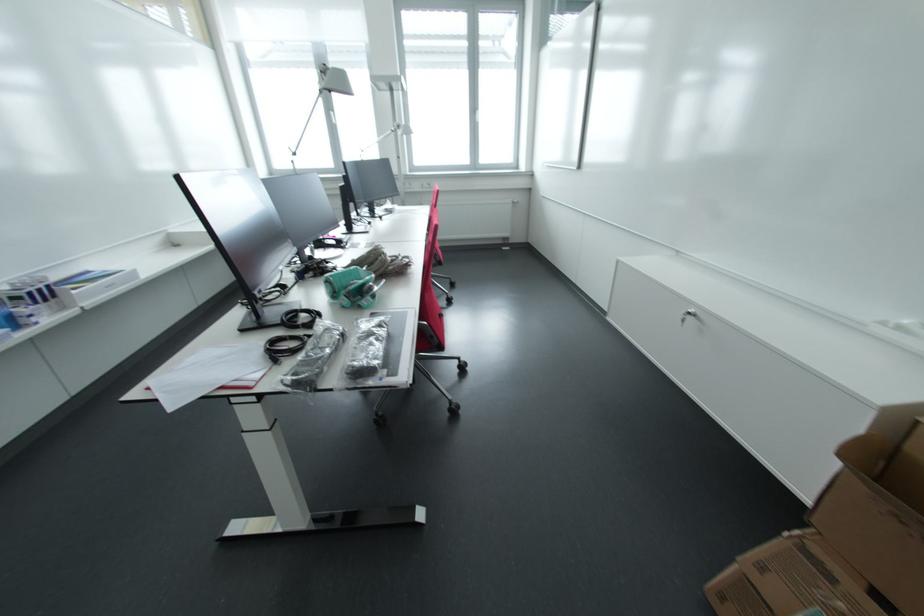
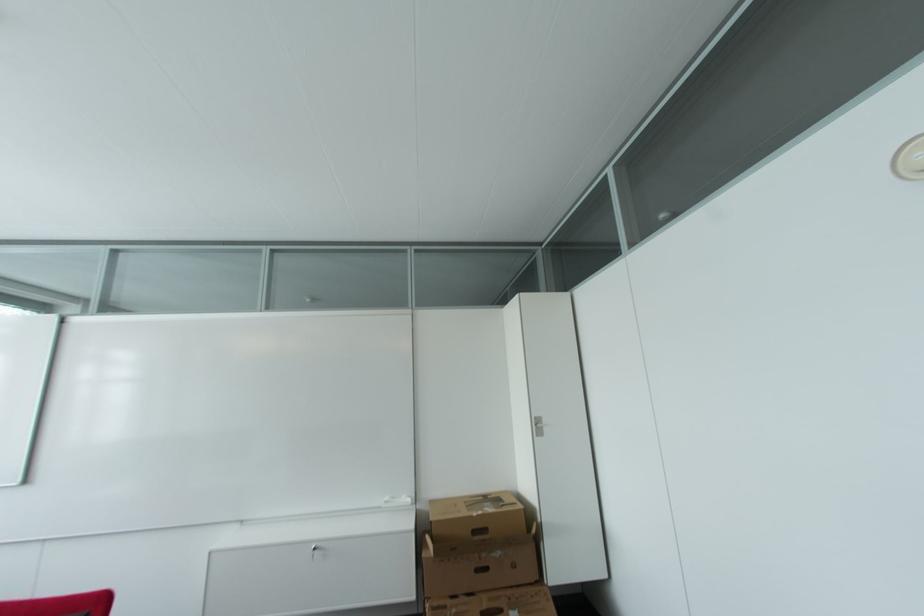
In the second image, find the point that corresponds to point (833, 578) in the first image.

(448, 609)